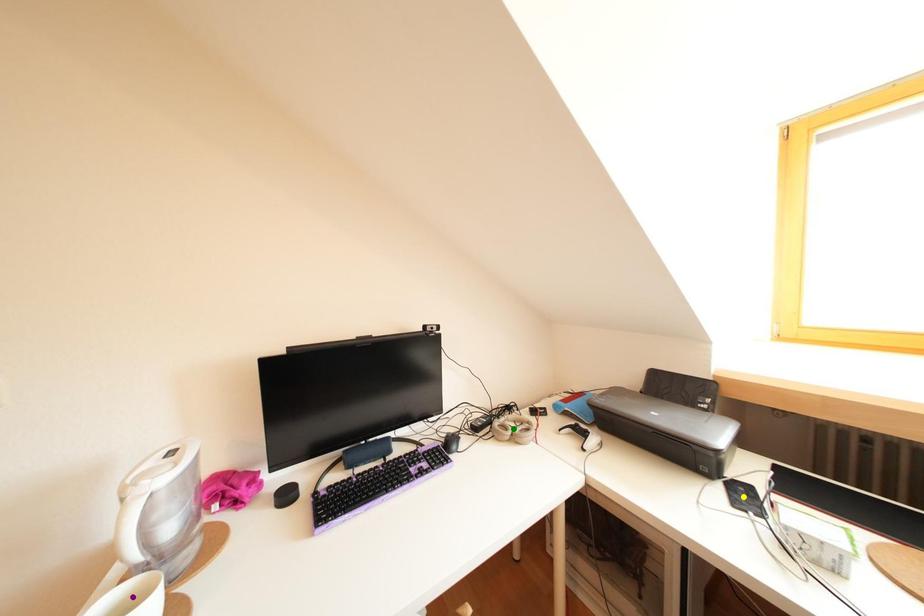
Order these from nearest to farthest:
green point | purple point | yellow point

purple point
yellow point
green point